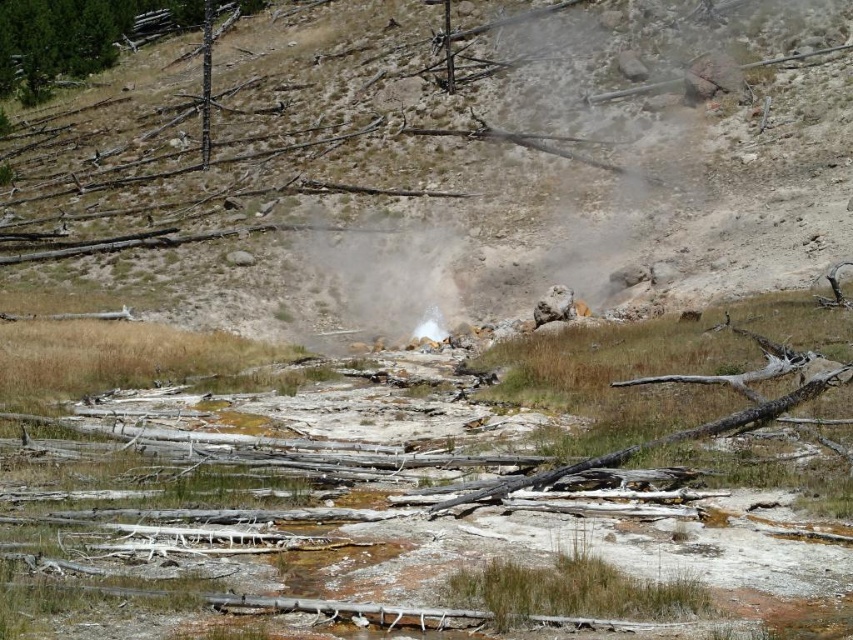
Between point (651, 161) and point (341, 296), which one is positioned in front?

Point (341, 296)

Where is `brown dirt hillside at center`? brown dirt hillside at center is located at coordinates (453, 170).

From the picture: Who is shorter, brown dirt hillside at center or green textured pine tree at upper left?

Standing shorter between the two is green textured pine tree at upper left.

Can you confirm if brown dirt hillside at center is shorter than green textured pine tree at upper left?

No.

Which is in front, point (340, 122) or point (0, 77)?

Point (340, 122) is in front.

I want to click on brown dirt hillside at center, so click(453, 170).

Can you confirm if white vapor at center is positioned above green textured pine tree at upper left?

Incorrect, white vapor at center is not positioned above green textured pine tree at upper left.

At what (x,y) coordinates should I click in order to perform the action: click on white vapor at center. Please return your answer as a coordinate pair (x, y). Image resolution: width=853 pixels, height=640 pixels. Looking at the image, I should click on (386, 280).